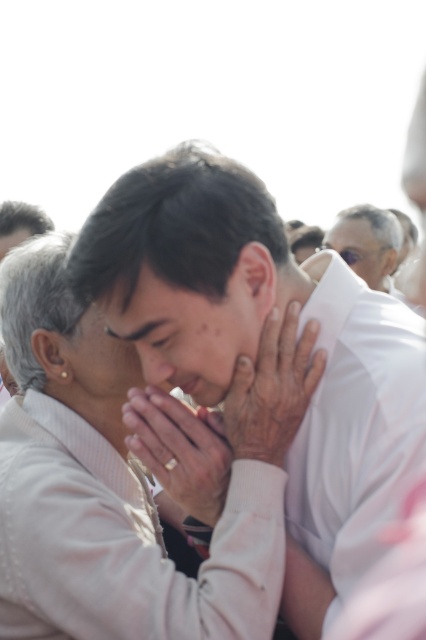
This screenshot has height=640, width=426. What do you see at coordinates (189, 330) in the screenshot? I see `smooth skin face at center` at bounding box center [189, 330].

Is smooth skin face at center below matte white face at upper right?

Yes, smooth skin face at center is below matte white face at upper right.

What do you see at coordinates (189, 330) in the screenshot? I see `smooth skin face at center` at bounding box center [189, 330].

Where is `smooth skin face at center`? The width and height of the screenshot is (426, 640). smooth skin face at center is located at coordinates (189, 330).

Is point (379, 444) positioned before point (354, 268)?

Yes.

Between point (317, 305) and point (330, 236), which one is positioned in front?

Point (317, 305) is more forward.

Between point (126, 305) and point (379, 252), which one is positioned in front?

Point (126, 305) is more forward.

Identify the location of white matte shirt at center. The width and height of the screenshot is (426, 640). (256, 348).

Is white matte hands at center positioned before matte white face at upper right?

Yes, it is in front of matte white face at upper right.

The height and width of the screenshot is (640, 426). I want to click on white matte hands at center, so click(180, 449).

The height and width of the screenshot is (640, 426). What are the coordinates of `white matte hands at center` in the screenshot? It's located at (180, 449).